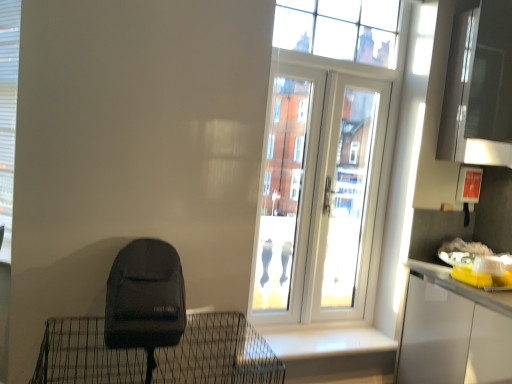
Question: Does white plastic shutter at left have a smaller size compared to white glossy window sill at lower center?

Choices:
 (A) no
 (B) yes

Answer: (B)

Question: Does white plastic shutter at left turn towards white glossy window sill at lower center?

Choices:
 (A) no
 (B) yes

Answer: (A)

Question: Would you say white plastic shutter at left is a long distance from white glossy window sill at lower center?

Choices:
 (A) no
 (B) yes

Answer: (B)

Question: Considering the relative sizes of white plastic shutter at left and white glossy window sill at lower center in the image provided, is white plastic shutter at left taller than white glossy window sill at lower center?

Choices:
 (A) no
 (B) yes

Answer: (B)

Question: Can you confirm if white plastic shutter at left is positioned to the right of white glossy window sill at lower center?

Choices:
 (A) no
 (B) yes

Answer: (A)

Question: From a real-world perspective, is white plastic shutter at left below white glossy window sill at lower center?

Choices:
 (A) yes
 (B) no

Answer: (B)

Question: Considering the relative sizes of white glossy door at upper center and white plastic shutter at left in the image provided, is white glossy door at upper center taller than white plastic shutter at left?

Choices:
 (A) no
 (B) yes

Answer: (B)

Question: Is white glossy door at upper center next to white plastic shutter at left and touching it?

Choices:
 (A) no
 (B) yes

Answer: (A)

Question: From a real-world perspective, does white glossy door at upper center stand above white plastic shutter at left?

Choices:
 (A) no
 (B) yes

Answer: (A)

Question: Is white glossy door at upper center positioned behind white plastic shutter at left?

Choices:
 (A) yes
 (B) no

Answer: (A)

Question: Considering the relative sizes of white glossy door at upper center and white plastic shutter at left in the image provided, is white glossy door at upper center shorter than white plastic shutter at left?

Choices:
 (A) no
 (B) yes

Answer: (A)

Question: From the image's perspective, is white glossy door at upper center located beneath white plastic shutter at left?

Choices:
 (A) yes
 (B) no

Answer: (A)

Question: Is white glossy window sill at lower center to the right of clear glass window at upper center from the viewer's perspective?

Choices:
 (A) no
 (B) yes

Answer: (A)